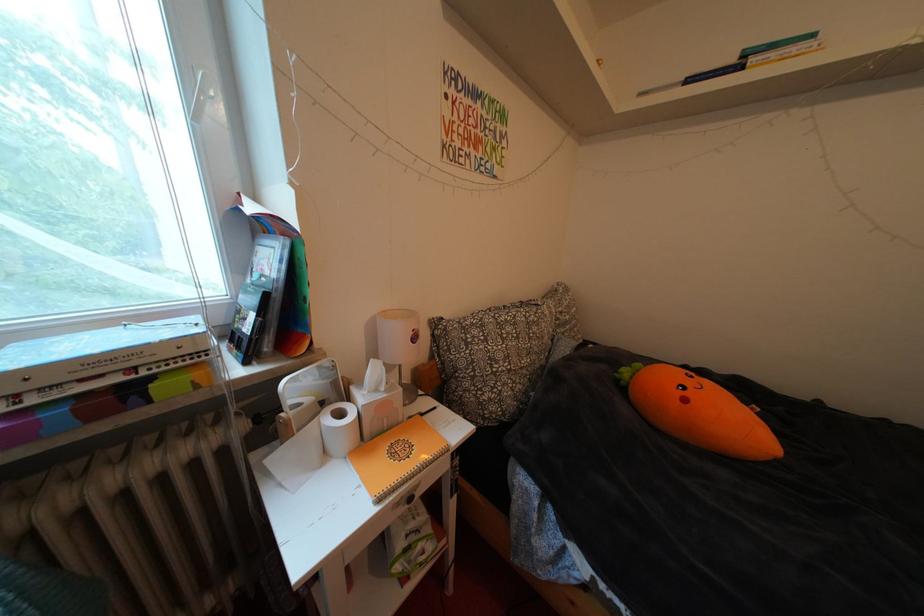
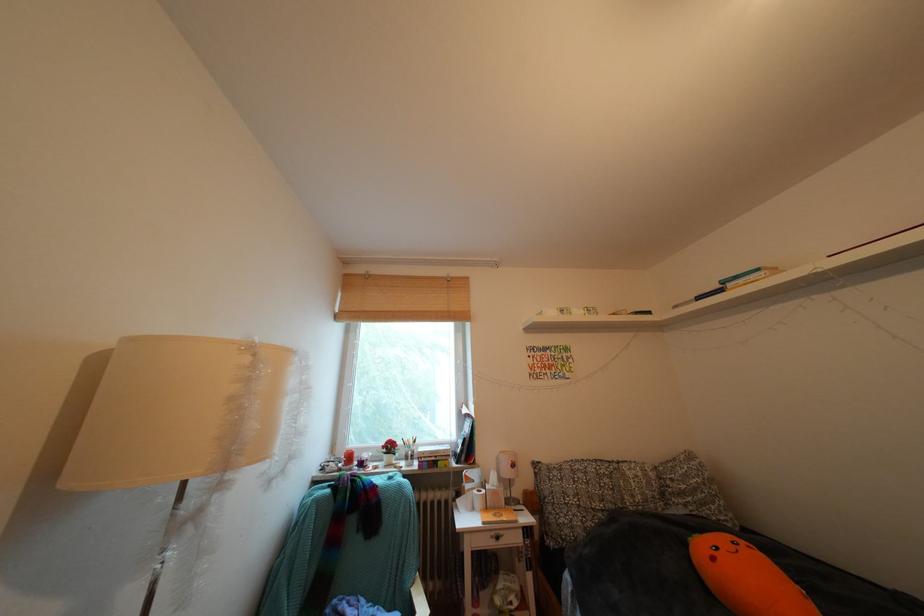
Where in the second image is the point corresponding to the point at 823,39 from the first image?

(768, 275)